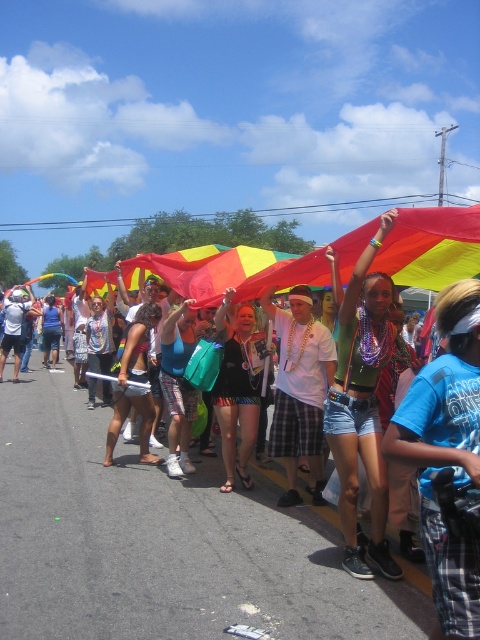
You are standing on the parade route and want to take a photo. There are two points marked in the image, point A at coordinates point (376,440) and point B at coordinates point (224,365). Which point is closer to you?

Point A at coordinates point (376,440) is closer to the viewer than point B at coordinates point (224,365).

You are a photographer trying to capture the vibrant colors of the parade. You notice a participant wearing a green fabric top at center and a black mesh tank top at center. Which clothing item is positioned higher on the participant to better highlight its color?

The green fabric top at center is located above the black mesh tank top at center, so it is positioned higher and would better highlight its color.